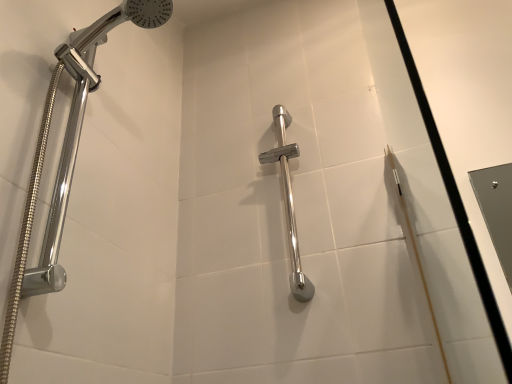
Question: Should I look upward or downward to see polished chrome grab bar at center, acting as the 2th shower starting from the left?

Choices:
 (A) down
 (B) up

Answer: (B)

Question: From the image's perspective, is polished chrome grab bar at center, acting as the 2th shower starting from the left, on top of polished chrome shower head at left, the 1th shower viewed from the left?

Choices:
 (A) yes
 (B) no

Answer: (B)

Question: Is polished chrome shower head at left, the 1th shower viewed from the left, at the back of polished chrome grab bar at center, which ranks as the first shower in back-to-front order?

Choices:
 (A) no
 (B) yes

Answer: (A)

Question: Is polished chrome grab bar at center, placed as the second shower when sorted from front to back, not close to polished chrome shower head at left, the 2th shower in the back-to-front sequence?

Choices:
 (A) no
 (B) yes

Answer: (A)

Question: Is polished chrome grab bar at center, which ranks as the first shower in back-to-front order, behind polished chrome shower head at left, the 1th shower viewed from the left?

Choices:
 (A) yes
 (B) no

Answer: (A)

Question: From the image's perspective, is polished chrome grab bar at center, acting as the 2th shower starting from the left, below polished chrome shower head at left, the 1th shower in the front-to-back sequence?

Choices:
 (A) yes
 (B) no

Answer: (A)

Question: Is polished chrome grab bar at center, acting as the 2th shower starting from the left, next to polished chrome shower head at left, the 1th shower viewed from the left, and touching it?

Choices:
 (A) no
 (B) yes

Answer: (A)

Question: Does polished chrome shower head at left, which appears as the second shower when viewed from the right, have a smaller size compared to polished chrome grab bar at center, acting as the 2th shower starting from the left?

Choices:
 (A) yes
 (B) no

Answer: (B)

Question: Is polished chrome shower head at left, the 2th shower in the back-to-front sequence, further to camera compared to polished chrome grab bar at center, which ranks as the first shower in back-to-front order?

Choices:
 (A) no
 (B) yes

Answer: (A)

Question: Would you say polished chrome shower head at left, the 2th shower in the back-to-front sequence, contains polished chrome grab bar at center, placed as the second shower when sorted from front to back?

Choices:
 (A) yes
 (B) no

Answer: (B)

Question: Does polished chrome shower head at left, which appears as the second shower when viewed from the right, turn towards polished chrome grab bar at center, placed as the second shower when sorted from front to back?

Choices:
 (A) yes
 (B) no

Answer: (B)

Question: Does polished chrome shower head at left, the 2th shower in the back-to-front sequence, have a greater height compared to polished chrome grab bar at center, acting as the 2th shower starting from the left?

Choices:
 (A) yes
 (B) no

Answer: (A)

Question: From the image's perspective, does polished chrome shower head at left, the 1th shower in the front-to-back sequence, appear lower than polished chrome grab bar at center, acting as the 2th shower starting from the left?

Choices:
 (A) no
 (B) yes

Answer: (A)

Question: Considering the positions of polished chrome grab bar at center, which ranks as the first shower in back-to-front order, and polished chrome shower head at left, the 2th shower in the back-to-front sequence, in the image, is polished chrome grab bar at center, which ranks as the first shower in back-to-front order, wider or thinner than polished chrome shower head at left, the 2th shower in the back-to-front sequence,?

Choices:
 (A) thin
 (B) wide

Answer: (A)